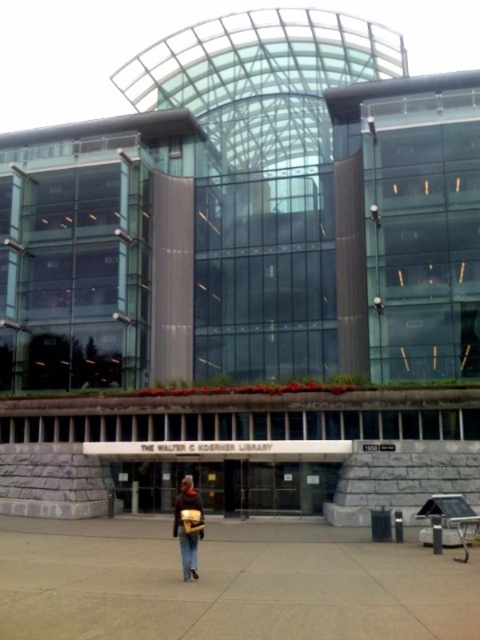
Question: Which point is farther from the camera taking this photo?

Choices:
 (A) (188, 563)
 (B) (191, 490)

Answer: (B)

Question: Can you confirm if leather backpack at center is positioned above brown matte jacket at lower center?

Choices:
 (A) yes
 (B) no

Answer: (A)

Question: Which point is closer to the camera?

Choices:
 (A) leather backpack at center
 (B) denim at lower center
 (C) brown matte jacket at lower center

Answer: (B)

Question: Is leather backpack at center wider than denim at lower center?

Choices:
 (A) no
 (B) yes

Answer: (B)

Question: Observing the image, what is the correct spatial positioning of denim at lower center in reference to brown matte jacket at lower center?

Choices:
 (A) right
 (B) left

Answer: (A)

Question: Which of the following is the farthest from the observer?

Choices:
 (A) denim at lower center
 (B) brown matte jacket at lower center

Answer: (B)